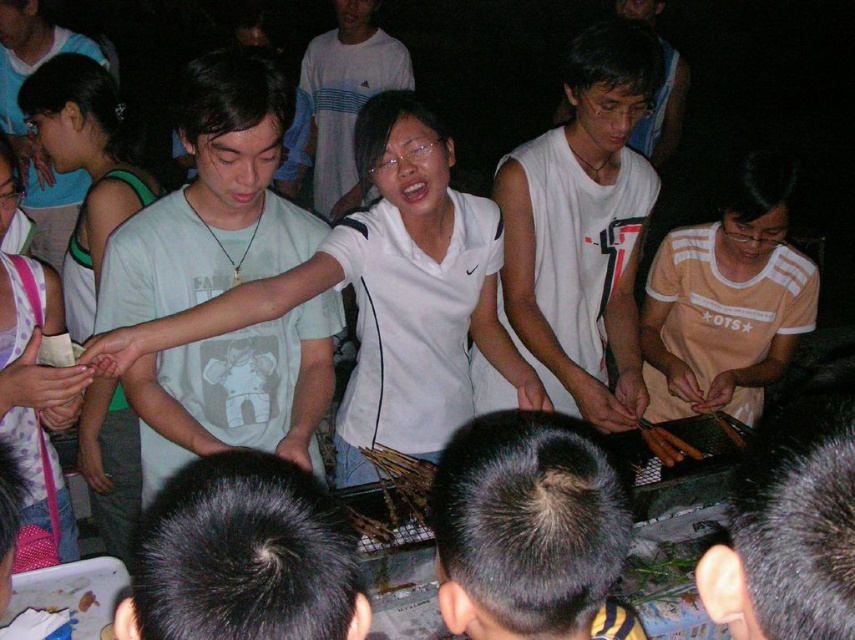
Question: Considering the real-world distances, which object is farthest from the white jersey at center?

Choices:
 (A) white matte shirt at center
 (B) orange cotton shirt at lower right
 (C) brown crispy chicken at center
 (D) brown wooden skewers at center

Answer: (A)

Question: Can you confirm if white jersey at center is thinner than white matte shirt at center?

Choices:
 (A) yes
 (B) no

Answer: (A)

Question: In this image, where is light gray t-shirt at center located relative to white cotton shirt at upper left?

Choices:
 (A) left
 (B) right

Answer: (B)

Question: Among these objects, which one is farthest from the camera?

Choices:
 (A) light gray t-shirt at center
 (B) white jersey at center

Answer: (B)

Question: Is white jersey at center smaller than dark hair at center?

Choices:
 (A) yes
 (B) no

Answer: (B)

Question: Which of the following is the closest to the observer?

Choices:
 (A) white cotton shirt at upper left
 (B) white jersey at center

Answer: (B)